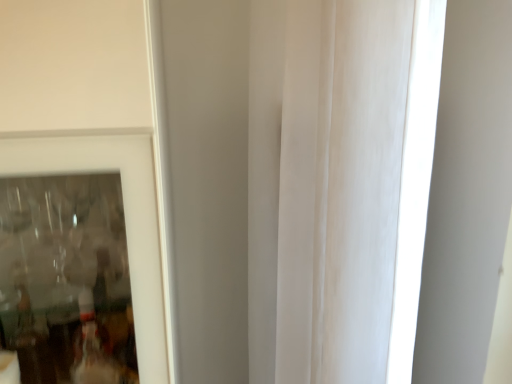
In order to face white sheer fabric at right, should I rotate leftwards or rightwards?

To face it directly, rotate right by 10.627 degrees.

This screenshot has height=384, width=512. What do you see at coordinates (325, 186) in the screenshot? I see `white sheer fabric at right` at bounding box center [325, 186].

The width and height of the screenshot is (512, 384). I want to click on white sheer fabric at right, so click(325, 186).

Locate an element on the screen. This screenshot has width=512, height=384. white sheer fabric at right is located at coordinates tap(325, 186).